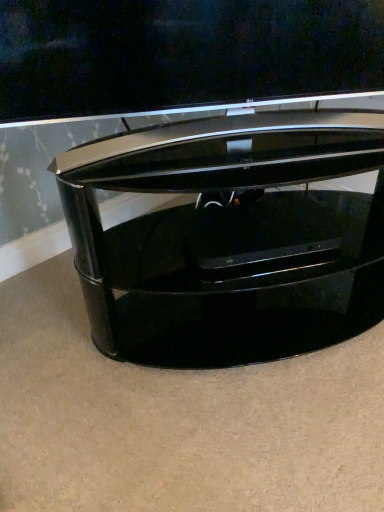
Find the location of `blank space situated above glossy black tv stand at center (from a real-world perspective)`. blank space situated above glossy black tv stand at center (from a real-world perspective) is located at coordinates (242, 130).